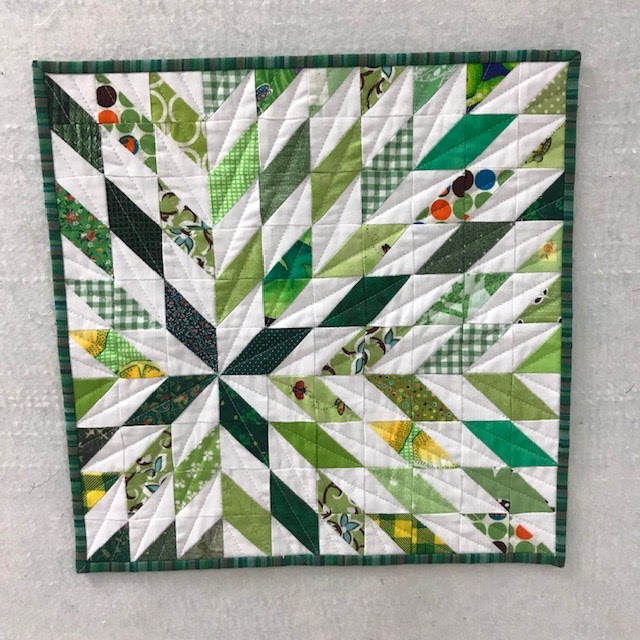
Identify the location of space below quilt. The width and height of the screenshot is (640, 640). (347, 601).